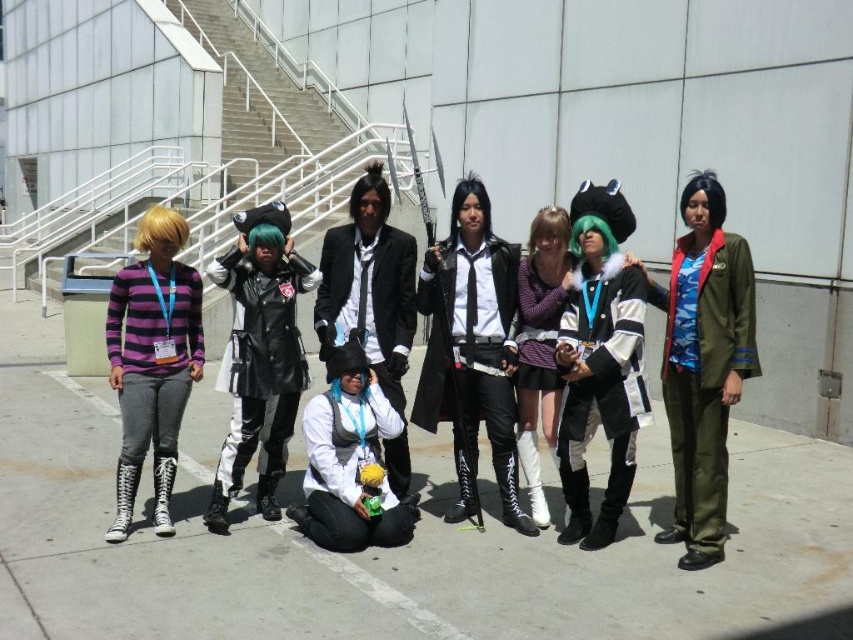
Question: Which object is positioned farthest from the matte black coat at center?

Choices:
 (A) camouflage fabric jacket at right
 (B) white concrete stairs at center
 (C) leather jacket at center

Answer: (B)

Question: Which point is closer to the camera taking this photo?

Choices:
 (A) [376, 490]
 (B) [619, 339]
 (C) [450, 344]
 (D) [236, 300]

Answer: (B)

Question: Is black leather jacket at center bigger than purple striped sweater at center?

Choices:
 (A) no
 (B) yes

Answer: (B)

Question: Observing the image, what is the correct spatial positioning of purple striped sweater at left in reference to leather jacket at center?

Choices:
 (A) right
 (B) left

Answer: (B)

Question: Which point appears closest to the camera in this image?

Choices:
 (A) (537, 522)
 (B) (213, 161)
 (C) (370, 346)

Answer: (A)

Question: Can you confirm if white matte vest at center is positioned to the right of camouflage fabric jacket at right?

Choices:
 (A) no
 (B) yes

Answer: (A)